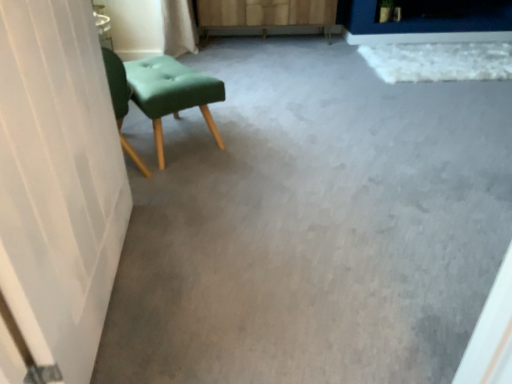
Question: In terms of width, does matte gray carpet at center look wider or thinner when compared to matte green fabric stool at left?

Choices:
 (A) thin
 (B) wide

Answer: (B)

Question: Is matte gray carpet at center bigger or smaller than matte green fabric stool at left?

Choices:
 (A) small
 (B) big

Answer: (B)

Question: Estimate the real-world distances between objects in this image. Which object is closer to the matte gray carpet at center?

Choices:
 (A) matte green fabric stool at left
 (B) wooden dresser at center

Answer: (A)

Question: Estimate the real-world distances between objects in this image. Which object is closer to the wooden dresser at center?

Choices:
 (A) matte gray carpet at center
 (B) matte green fabric stool at left

Answer: (B)